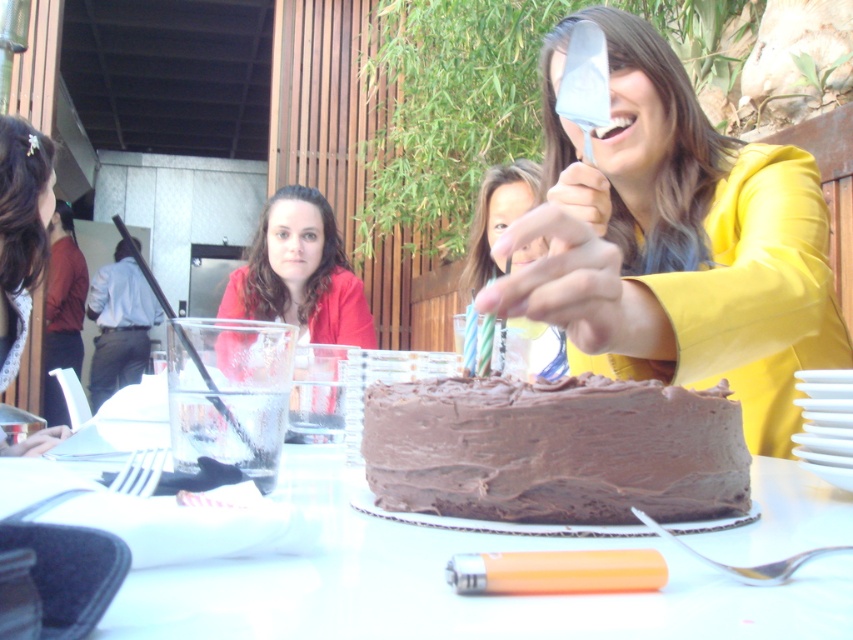
You are a photographer at the birthday celebration. You want to take a photo of the yellow matte jacket at upper right and the smooth white table at center. Which object is taller in the image?

The yellow matte jacket at upper right has a greater height compared to the smooth white table at center, so the yellow matte jacket at upper right is taller.

You are planning to place a rectangular cake stand on the smooth white table at center. The stand measures 30 cm in length and 20 cm in width. Given the table dimensions are 120 cm by 60 cm, will the cake stand fit on the table without overlapping the edges?

The smooth white table at center has dimensions of 120 cm by 60 cm. The cake stand measures 30 cm by 20 cm, which is smaller than the table in both length and width. Therefore, the cake stand will fit on the table without overlapping the edges.

You are at the birthday celebration scene and want to find the matte red jacket at center. Where is it located in the image?

The matte red jacket at center is located at point coordinates of (300, 273) in the image.